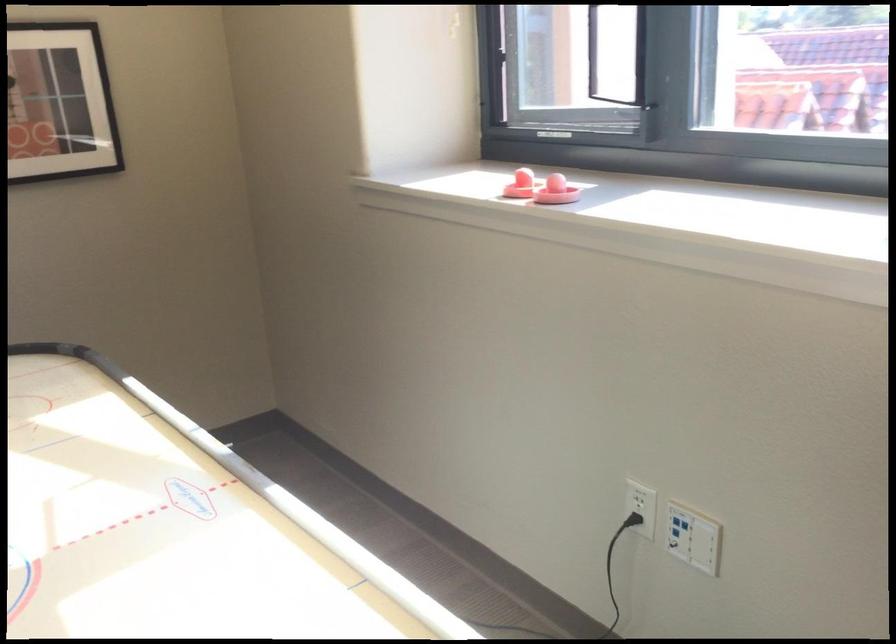
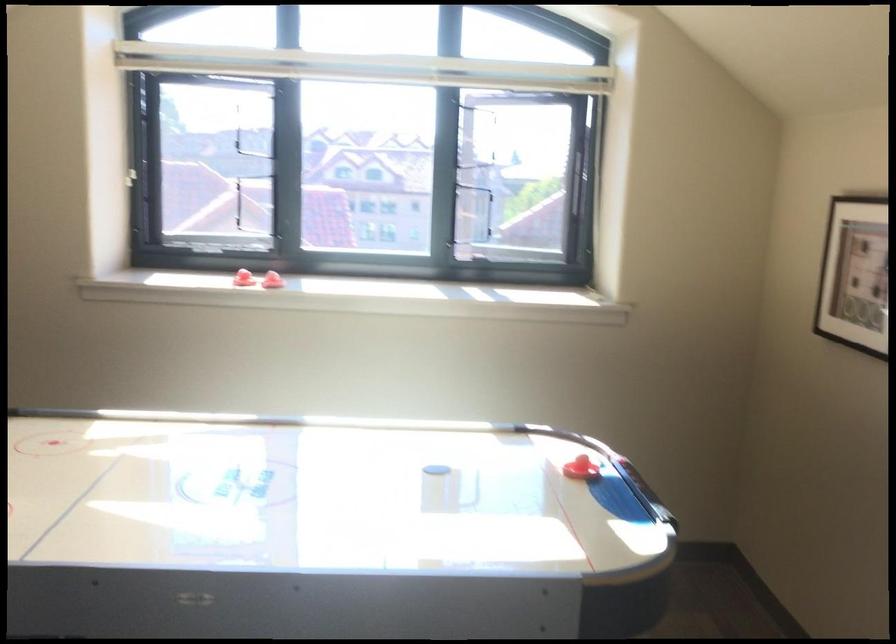
Question: I am providing you with two images of the same scene from different viewpoints. Which of the following objects are not visible in image2?

Choices:
 (A) red air hockey striker
 (B) white wall button
 (C) black bowl
 (D) window latch

Answer: (B)